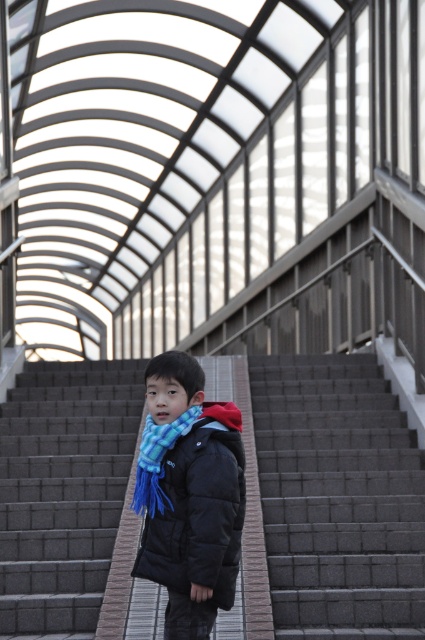
You are a drone operator trying to capture a photo of the gray concrete stairs at center from above. What are the coordinates where you should position the camera to ensure the stairs are centered in the frame?

The coordinates to position the camera for capturing the gray concrete stairs at center are at point [337,499].